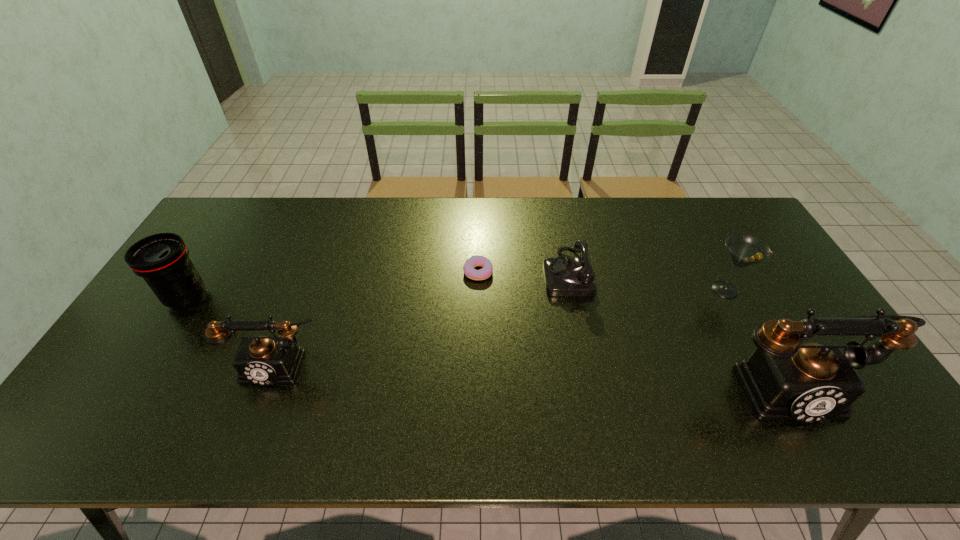
Image resolution: width=960 pixels, height=540 pixels. Find the location of `the second shortest telephone`. the second shortest telephone is located at coordinates (262, 360).

Locate an element on the screen. the leftmost telephone is located at coordinates (262, 360).

You are a GUI agent. You are given a task and a screenshot of the screen. Output one action in this format:
    pyautogui.click(x=<x>, y=<y>)
    Task: Click on the tallest object
    This screenshot has width=960, height=540.
    Given the screenshot: What is the action you would take?
    pyautogui.click(x=784, y=379)

Where is `the tallest telephone`? the tallest telephone is located at coordinates (784, 379).

Where is `the shortest object`? the shortest object is located at coordinates (474, 261).

Locate an element on the screen. The width and height of the screenshot is (960, 540). the fourth object from right to left is located at coordinates (474, 261).

This screenshot has height=540, width=960. In order to click on martini in this screenshot , I will do [745, 250].

Locate an element on the screen. Image resolution: width=960 pixels, height=540 pixels. the second telephone from left to right is located at coordinates (564, 276).

Locate an element on the screen. the shortest telephone is located at coordinates (564, 276).

Find the location of `telephoto lens`. telephoto lens is located at coordinates (162, 259).